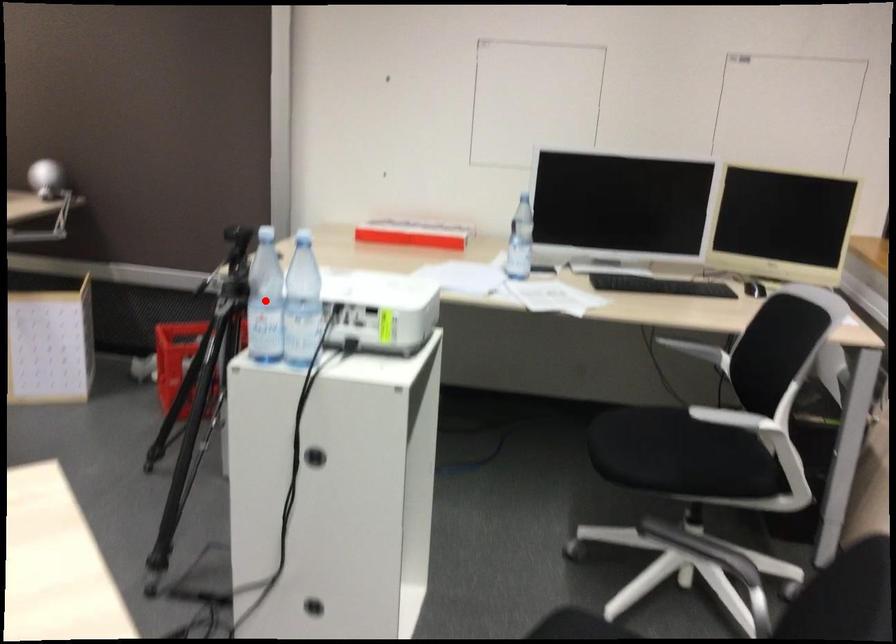
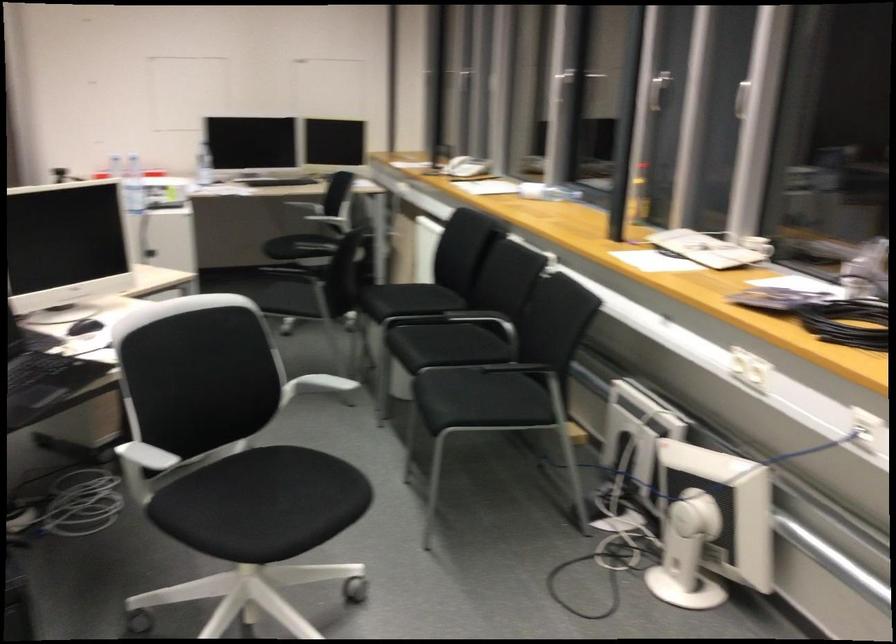
Question: I am providing you with two images of the same scene from different viewpoints. A red point is marked on the first image. At the location where the point appears in image 1, is it still visible in image 2?

Choices:
 (A) Yes
 (B) No

Answer: (B)